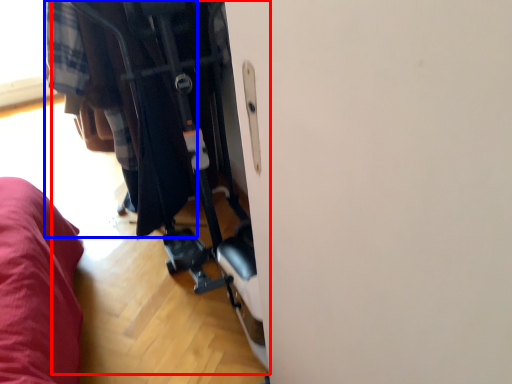
Question: Which object appears farthest to the camera in this image, baby carriage (highlighted by a red box) or clothing (highlighted by a blue box)?

Choices:
 (A) baby carriage
 (B) clothing

Answer: (B)